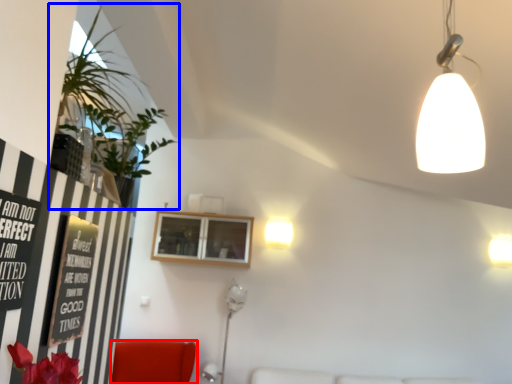
Question: Which object is further to the camera taking this photo, furniture (highlighted by a red box) or houseplant (highlighted by a blue box)?

Choices:
 (A) furniture
 (B) houseplant

Answer: (A)